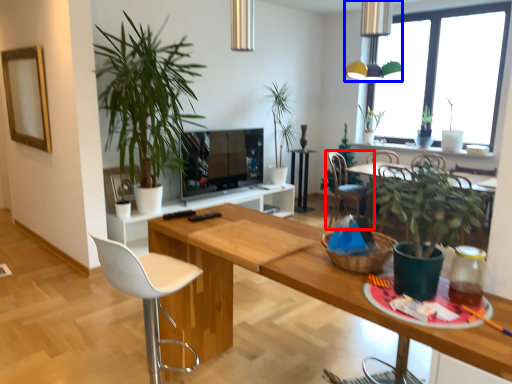
Question: Which of the following is the closest to the observer, chair (highlighted by a red box) or light fixture (highlighted by a blue box)?

Choices:
 (A) chair
 (B) light fixture

Answer: (B)